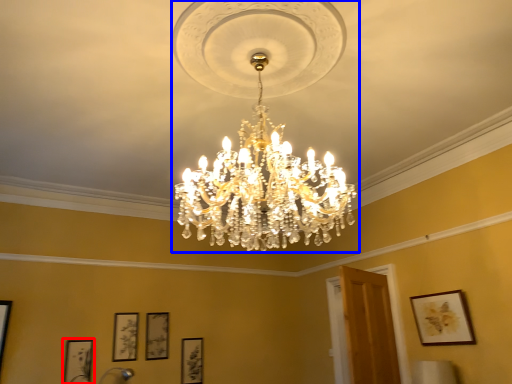
Question: Which of the following is the closest to the observer, picture frame (highlighted by a red box) or lamp (highlighted by a blue box)?

Choices:
 (A) picture frame
 (B) lamp

Answer: (B)